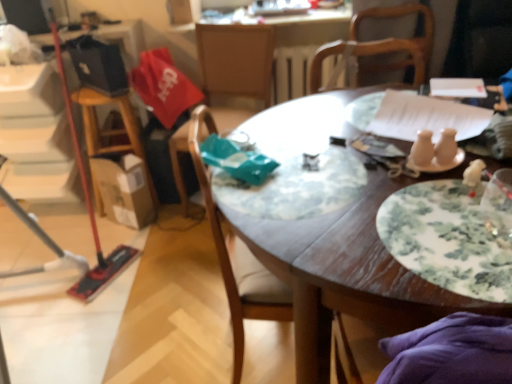
This screenshot has width=512, height=384. In order to click on blank space situated above floral-patterned ceramic plate at center-right (from a real-world perspective) in this screenshot , I will do `click(460, 220)`.